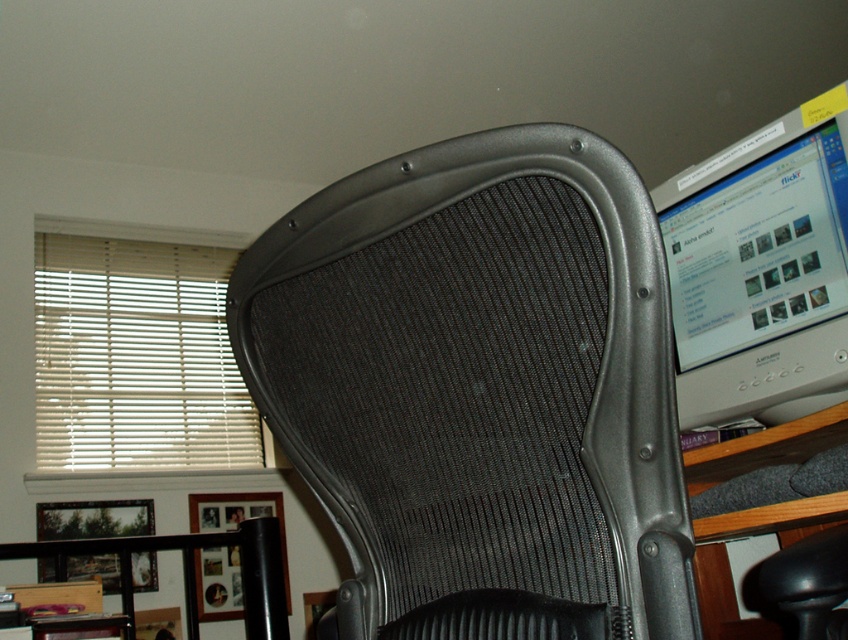
Does black mesh swivel chair at center appear on the right side of silver metallic monitor at upper right?

No, black mesh swivel chair at center is not to the right of silver metallic monitor at upper right.

Find the location of a particular element. The height and width of the screenshot is (640, 848). black mesh swivel chair at center is located at coordinates (480, 388).

This screenshot has height=640, width=848. I want to click on black mesh swivel chair at center, so click(480, 388).

Between silver metallic monitor at upper right and white/wooden blinds at left, which one is positioned higher?

silver metallic monitor at upper right is higher up.

Who is more distant from viewer, (757,269) or (123,285)?

The point (123,285) is behind.

Which is in front, point (763, 310) or point (222, 465)?

Point (763, 310) is more forward.

Identify the location of silver metallic monitor at upper right. Image resolution: width=848 pixels, height=640 pixels. (762, 269).

Which is below, black mesh swivel chair at center or white/wooden blinds at left?

black mesh swivel chair at center is lower down.

Who is taller, black mesh swivel chair at center or white/wooden blinds at left?

white/wooden blinds at left

Where is `black mesh swivel chair at center`? This screenshot has height=640, width=848. black mesh swivel chair at center is located at coordinates (480, 388).

The width and height of the screenshot is (848, 640). What are the coordinates of `black mesh swivel chair at center` in the screenshot? It's located at (480, 388).